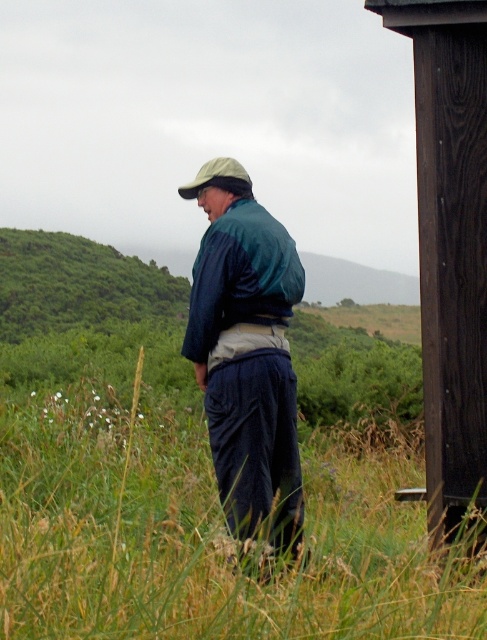
Question: Is dark brown wood post at right closer to camera compared to green fabric hat at upper center?

Choices:
 (A) no
 (B) yes

Answer: (B)

Question: Estimate the real-world distances between objects in this image. Which object is closer to the green fabric hat at upper center?

Choices:
 (A) green grass at center
 (B) green fabric jacket at center

Answer: (B)

Question: Which point is closer to the camera?

Choices:
 (A) green fabric hat at upper center
 (B) dark brown wood post at right
 (C) green grass at center
 (D) green fabric jacket at center

Answer: (C)

Question: Which point is farther to the camera?

Choices:
 (A) (298, 604)
 (B) (247, 179)
 (C) (269, 483)

Answer: (B)

Question: Does green grass at center appear on the right side of dark brown wood post at right?

Choices:
 (A) no
 (B) yes

Answer: (A)

Question: Does green grass at center lie behind dark brown wood post at right?

Choices:
 (A) no
 (B) yes

Answer: (A)